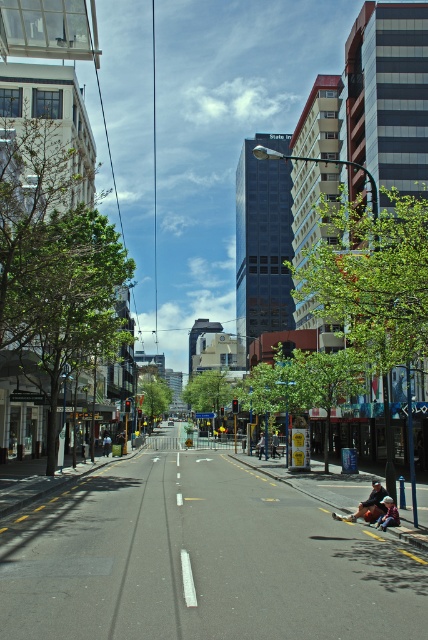
You are a customer in a clothing store and see two pairs of jeans displayed on a rack in the middle of the store. The blue denim jeans at center and the dark blue jeans at center. Which pair is positioned to the right?

The blue denim jeans at center are positioned to the right of the dark blue jeans at center.

You are standing in the middle of the street and see the leather jacket at lower right. Where exactly is the leather jacket located in relation to your position?

The leather jacket at lower right is located at point (371, 504) relative to your position.